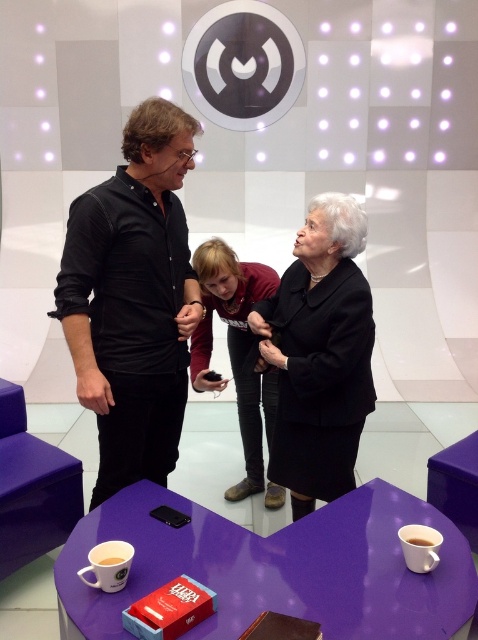
Is purple glossy table at lower center wider than black matte coat at center?

Yes, purple glossy table at lower center is wider than black matte coat at center.

Who is more distant from viewer, (184, 538) or (349, 220)?

The point (349, 220) is more distant.

Looking at this image, who is more distant from viewer, (471, 614) or (299, 372)?

Positioned behind is point (299, 372).

The width and height of the screenshot is (478, 640). Find the location of `purple glossy table at lower center`. purple glossy table at lower center is located at coordinates (278, 566).

Can you confirm if black matte shirt at center is wider than white paper cup at lower left?

Correct, the width of black matte shirt at center exceeds that of white paper cup at lower left.

Image resolution: width=478 pixels, height=640 pixels. What do you see at coordinates (132, 300) in the screenshot?
I see `black matte shirt at center` at bounding box center [132, 300].

Is point (131, 429) in front of point (111, 584)?

That is False.

Find the location of `black matte shirt at center`. black matte shirt at center is located at coordinates (132, 300).

Which is more to the left, black matte shirt at center or matte brown leather jacket at center?

black matte shirt at center is more to the left.

Consider the image. Does black matte shirt at center appear on the left side of matte brown leather jacket at center?

Yes, black matte shirt at center is to the left of matte brown leather jacket at center.

Is point (154, 132) positioned behind point (239, 387)?

No, it is in front of (239, 387).

Image resolution: width=478 pixels, height=640 pixels. Find the location of `black matte shirt at center`. black matte shirt at center is located at coordinates (132, 300).